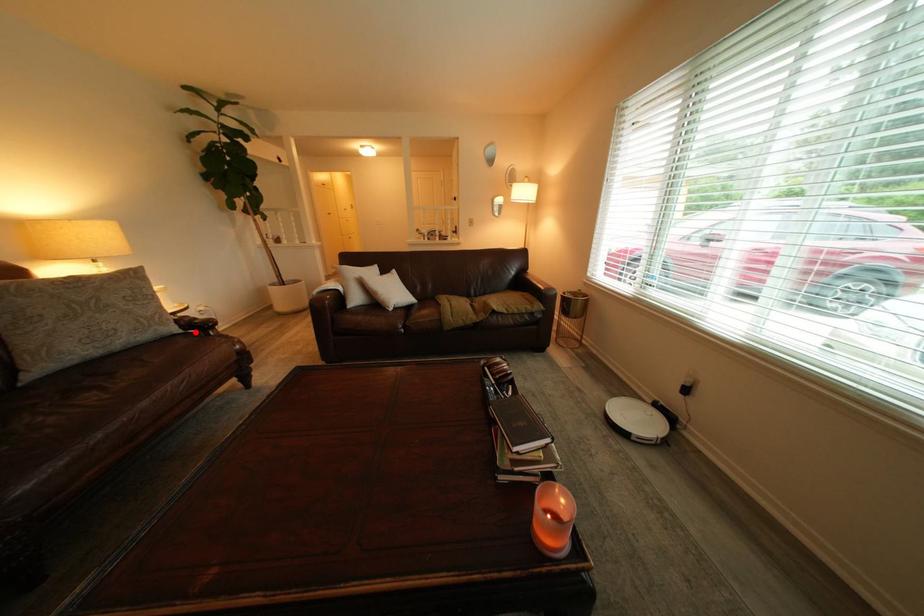
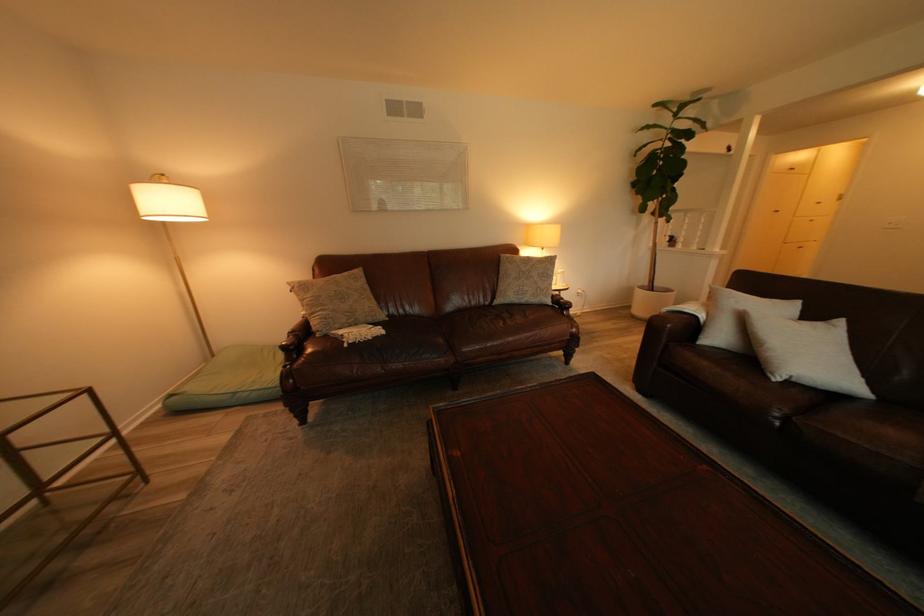
The point at the highlighted location is marked in the first image. Where is the corresponding point in the second image?

(565, 305)